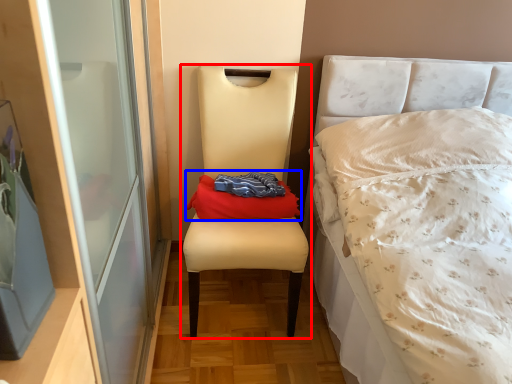
Question: Which object is further to the camera taking this photo, chair (highlighted by a red box) or throw pillow (highlighted by a blue box)?

Choices:
 (A) chair
 (B) throw pillow

Answer: (B)